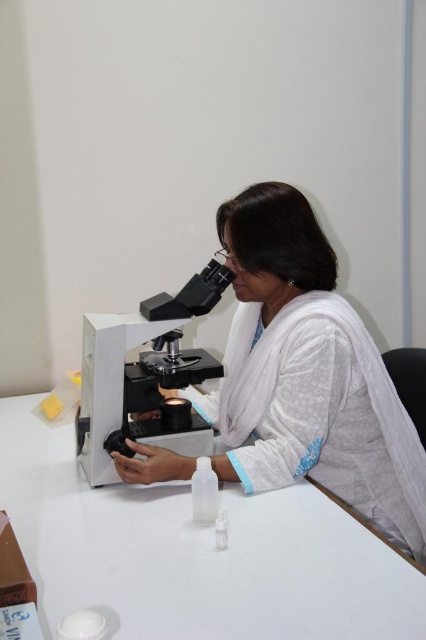
You are a scientist who needs to place a sample on the microscope. The white plastic table at center is to the left of the white plastic microscope at center. Which object should you move the sample from the table to the microscope?

The white plastic table at center is positioned on the left side of white plastic microscope at center, so you should move the sample from the white plastic table at center to the white plastic microscope at center.

What is the object located at the coordinates point [307,374] in the image?

The point [307,374] corresponds to the white matte or soft fabric at center.